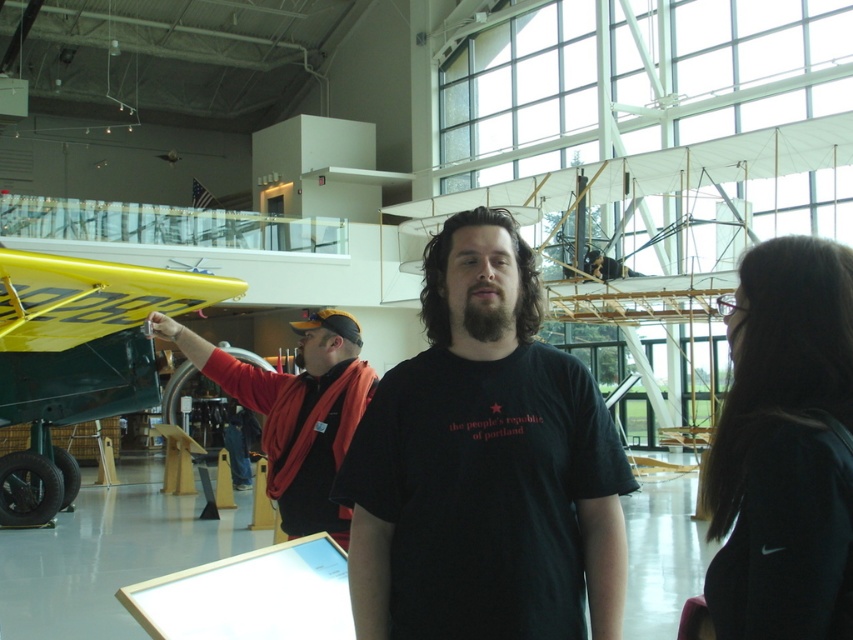
Question: Among these points, which one is nearest to the camera?

Choices:
 (A) (236, 394)
 (B) (802, 600)

Answer: (B)

Question: Can you confirm if black matte t-shirt at center is positioned above black fabric at center?

Choices:
 (A) yes
 (B) no

Answer: (A)

Question: Which point is farther from the camera taking this photo?

Choices:
 (A) (306, 486)
 (B) (544, 435)
 (C) (47, 296)
 (D) (766, 554)

Answer: (C)

Question: Observing the image, what is the correct spatial positioning of yellow matte airplane at left in reference to orange fabric jacket at center?

Choices:
 (A) left
 (B) right

Answer: (A)

Question: Which of the following is the closest to the observer?

Choices:
 (A) (770, 381)
 (B) (492, 445)
 (C) (53, 404)

Answer: (A)

Question: Observing the image, what is the correct spatial positioning of black matte t-shirt at center in reference to black fabric at center?

Choices:
 (A) below
 (B) above

Answer: (B)